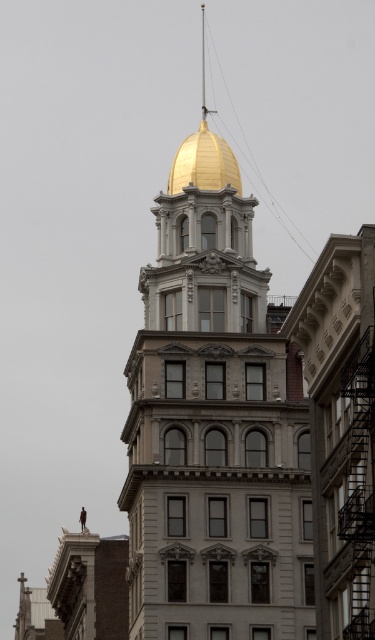
Can you confirm if gold polished dome at center is smaller than gold polished dome at top?

No.

Who is more distant from viewer, (166, 388) or (222, 148)?

Point (222, 148)

Find the location of a particular element. The image size is (375, 640). gold polished dome at center is located at coordinates (214, 438).